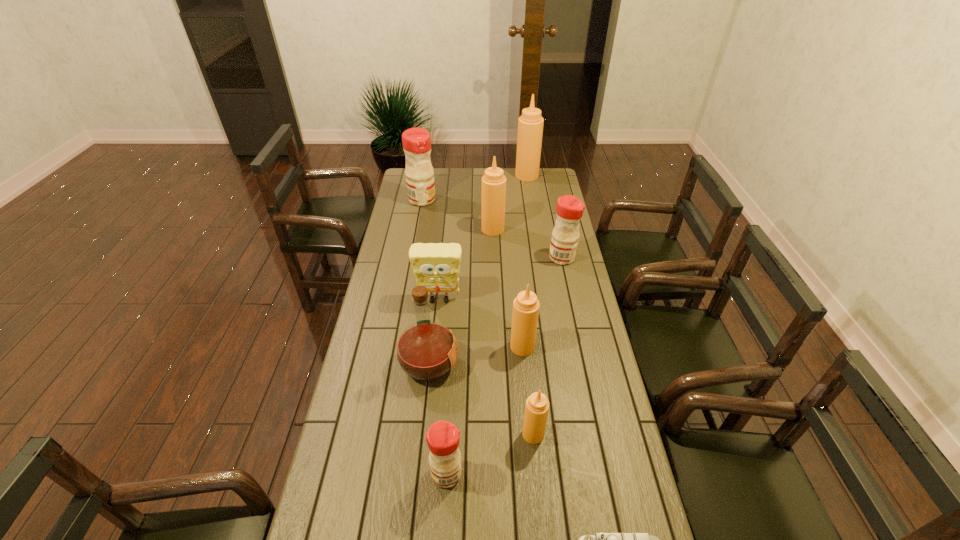
Locate an element on the screen. blank space at the right edge of the desktop is located at coordinates click(x=596, y=329).

Find the location of a particular element. The width and height of the screenshot is (960, 540). vacant area at the far right corner of the desktop is located at coordinates (536, 185).

Locate an element on the screen. free space between the liquor and the second smallest tan condiment is located at coordinates (475, 356).

Identify the location of unoccupied position between the second farthest condiment and the tallest condiment. (474, 188).

Identify the location of vacant point located between the pink liquor and the tallest object. The height and width of the screenshot is (540, 960). (478, 270).

This screenshot has height=540, width=960. I want to click on object that is the fourth closest one to the second nearest object, so click(x=526, y=306).

This screenshot has width=960, height=540. Identify the location of object that is the fifth closest to the camera. (436, 266).

You are a GUI agent. You are given a task and a screenshot of the screen. Output one action in this format:
    pyautogui.click(x=<x>, y=<y>)
    Task: Click on the third closest condiment to the third nearest object
    The width and height of the screenshot is (960, 540).
    Given the screenshot: What is the action you would take?
    pyautogui.click(x=564, y=242)

Select which condiment is the second closest to the nearest red condiment. Please provide its 2D coordinates. Your answer should be formatted as a tuple, i.e. [(x, y)], where the tuple contains the x and y coordinates of a point satisfying the conditions above.

[(526, 306)]

The height and width of the screenshot is (540, 960). I want to click on tan condiment that can be found as the third closest to the second biggest tan condiment, so click(537, 405).